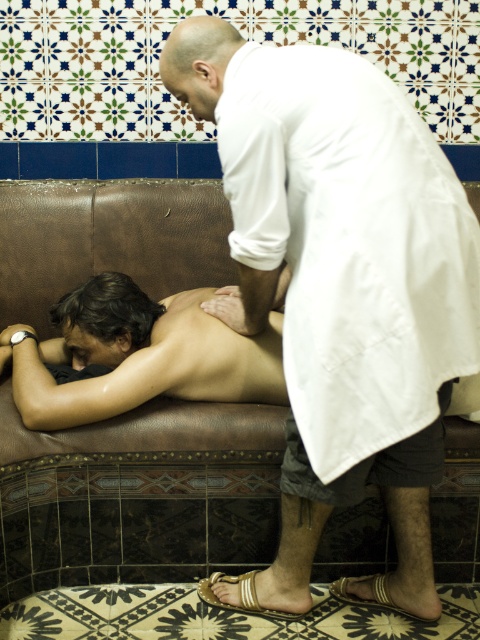
From the picture: You are a guest in the spa and want to locate the white matte robe at center. According to the scene description, where would you find it?

The white matte robe at center is located at point [349,244] in the scene.